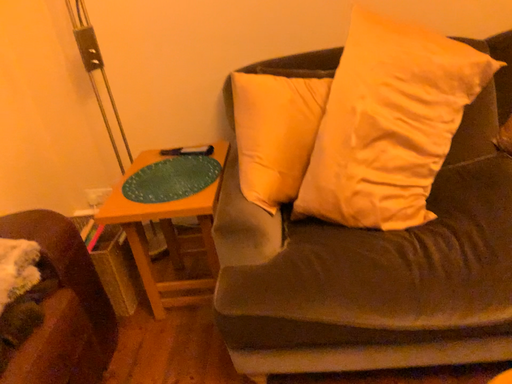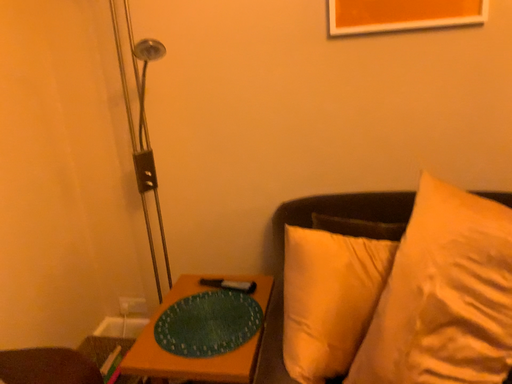
Question: Which way did the camera rotate in the video?

Choices:
 (A) rotated downward
 (B) rotated upward

Answer: (B)